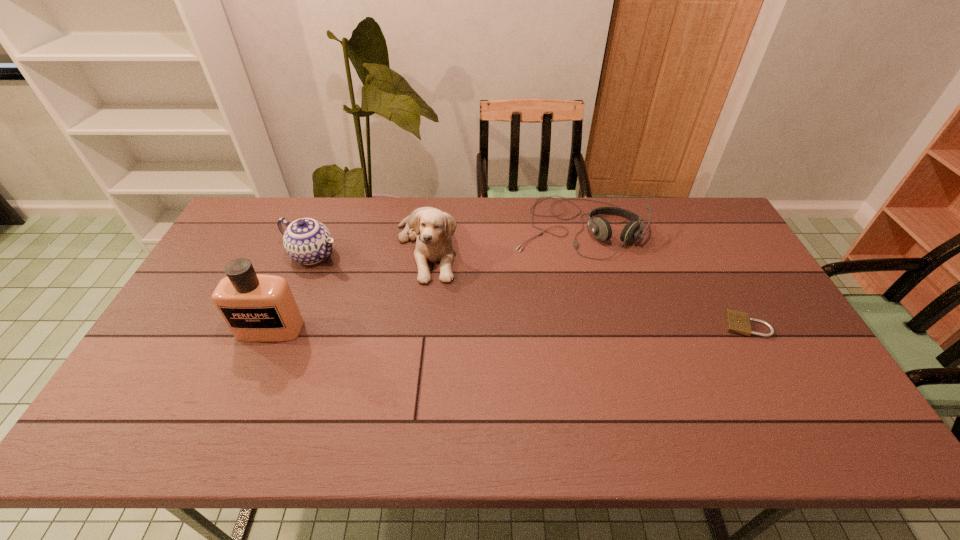
Image resolution: width=960 pixels, height=540 pixels. Identify the location of headset present at the far edge. (600, 227).

You are a GUI agent. You are given a task and a screenshot of the screen. Output one action in this format:
    pyautogui.click(x=<x>, y=<y>)
    Task: Click on the object present at the right edge
    
    Given the screenshot: What is the action you would take?
    pyautogui.click(x=738, y=322)

Find the location of a particular element. This screenshot has width=960, height=540. vacant space at the far edge is located at coordinates (596, 218).

Where is `vacant space at the near edge`? This screenshot has height=540, width=960. vacant space at the near edge is located at coordinates (468, 374).

Locate an element on the screen. Image resolution: width=960 pixels, height=540 pixels. vacant area at the left edge of the desktop is located at coordinates (203, 296).

You are a GUI agent. You are given a task and a screenshot of the screen. Output one action in this format:
    pyautogui.click(x=<x>, y=<y>)
    Task: Click on the vacant area at the right edge
    
    Given the screenshot: What is the action you would take?
    pyautogui.click(x=738, y=301)

In the image, there is a desktop. Where is `free space at the far left corner`? This screenshot has width=960, height=540. free space at the far left corner is located at coordinates (264, 230).

You are a GUI agent. You are given a task and a screenshot of the screen. Output one action in this format:
    pyautogui.click(x=<x>, y=<y>)
    Task: Click on the free point between the third object from left to right and the perfume
    This screenshot has width=960, height=540.
    Given the screenshot: What is the action you would take?
    pyautogui.click(x=348, y=288)

What are the coordinates of `free space between the puppy and the headset` in the screenshot? It's located at click(502, 237).

The width and height of the screenshot is (960, 540). In order to click on free spot between the shortest object and the perfume in this screenshot , I will do `click(508, 327)`.